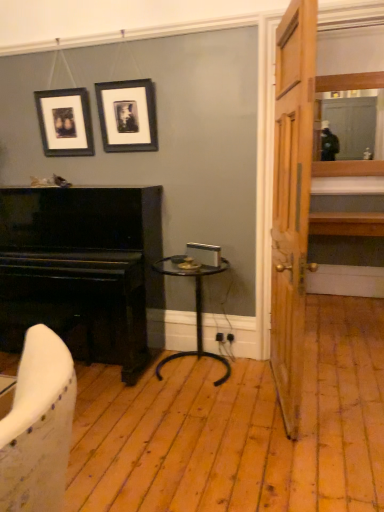
Question: From a real-world perspective, relative to black matte picture frame at upper center, which is counted as the 2th picture frame, starting from the left, is wooden door at right vertically above or below?

Choices:
 (A) above
 (B) below

Answer: (B)

Question: Which is correct: wooden door at right is inside black matte picture frame at upper center, which is counted as the 2th picture frame, starting from the left, or outside of it?

Choices:
 (A) outside
 (B) inside

Answer: (A)

Question: Which of these objects is positioned closest to the black matte picture frame at upper center, which is counted as the 2th picture frame, starting from the left?

Choices:
 (A) black metal side table at center
 (B) matte black picture frame at upper left, the second picture frame from the right
 (C) wooden door at right
 (D) black polished piano at left

Answer: (B)

Question: Which object is positioned closest to the black matte picture frame at upper center, which ranks as the 1th picture frame in right-to-left order?

Choices:
 (A) black metal side table at center
 (B) black polished piano at left
 (C) wooden door at right
 (D) matte black picture frame at upper left, which is the first picture frame in left-to-right order

Answer: (D)